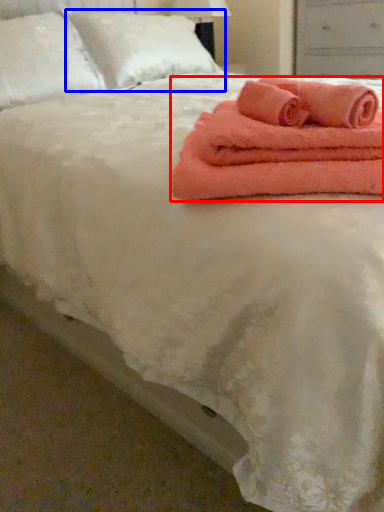
Question: Which object appears closest to the camera in this image, towel (highlighted by a red box) or pillow (highlighted by a blue box)?

Choices:
 (A) towel
 (B) pillow

Answer: (A)